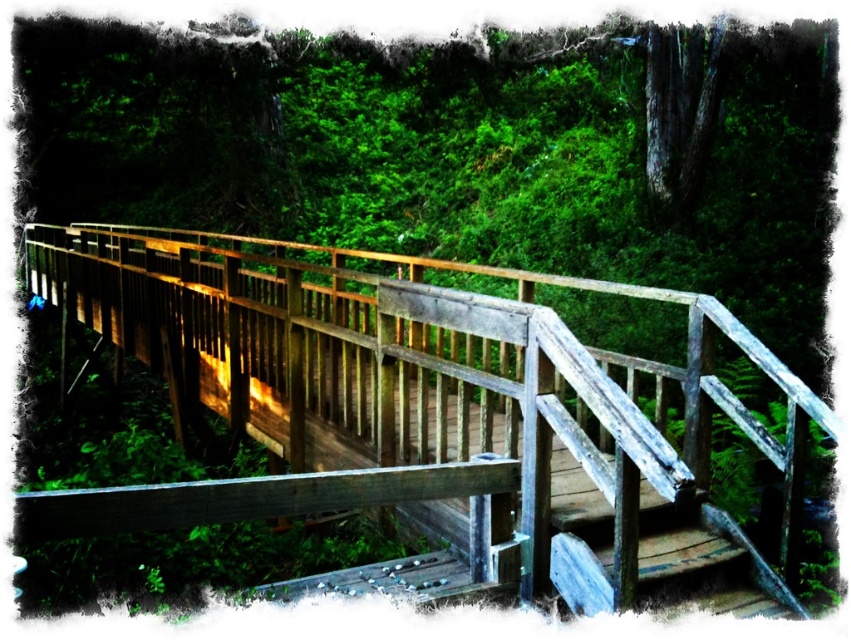
Question: Can you confirm if weathered wood bridge at center is smaller than weathered wood stairs at center?

Choices:
 (A) no
 (B) yes

Answer: (B)

Question: Can you confirm if weathered wood bridge at center is positioned to the left of weathered wood stairs at center?

Choices:
 (A) no
 (B) yes

Answer: (A)

Question: Which of the following is the closest to the observer?

Choices:
 (A) weathered wood bridge at center
 (B) weathered wood stairs at center

Answer: (B)

Question: Among these points, which one is farthest from the camera?

Choices:
 (A) (609, 570)
 (B) (610, 577)

Answer: (A)

Question: Which point is farther from the camera taking this photo?

Choices:
 (A) (580, 588)
 (B) (557, 388)

Answer: (B)

Question: Where is weathered wood bridge at center located in relation to weathered wood stairs at center in the image?

Choices:
 (A) below
 (B) above

Answer: (B)